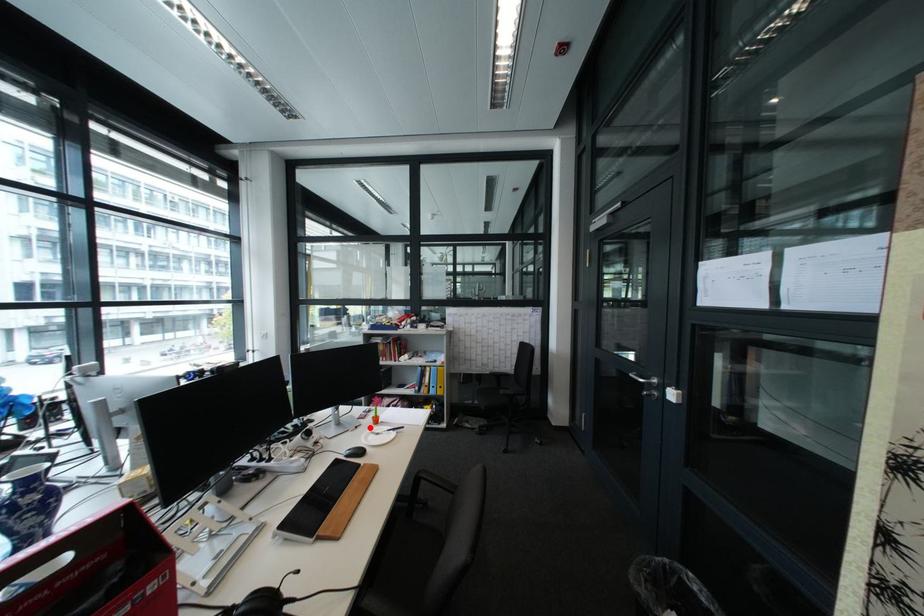
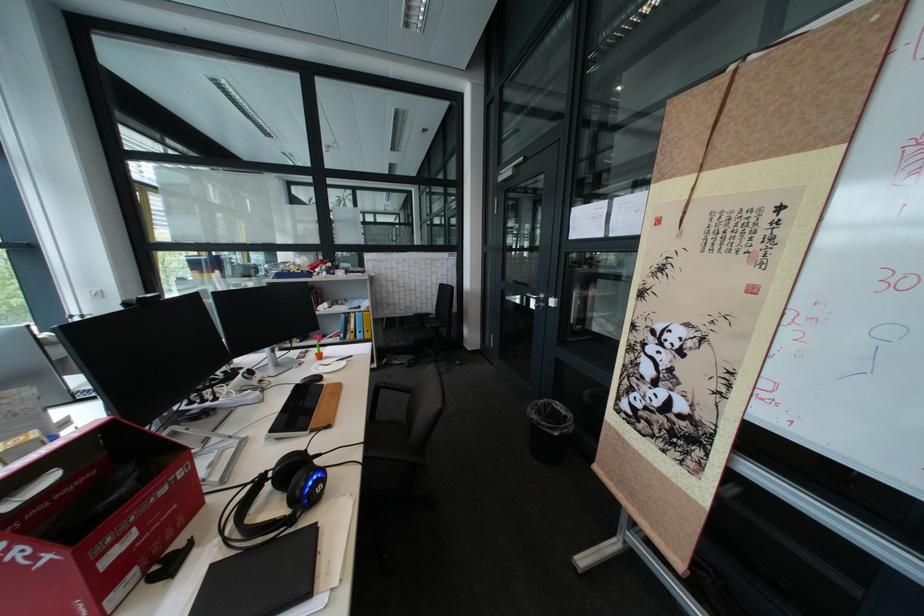
Question: I am providing you with two images of the same scene from different viewpoints. A red point is shown in image1. For the corresponding object point in image2, is it positioned nearer or farther from the camera?

Choices:
 (A) Nearer
 (B) Farther

Answer: (B)